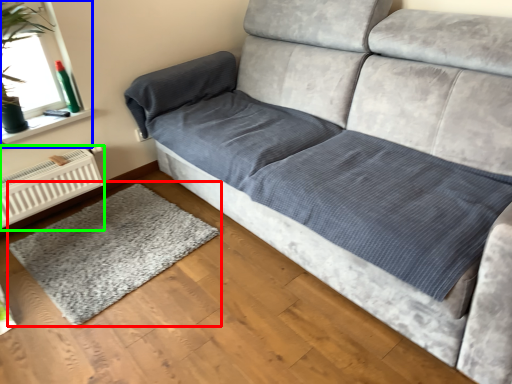
Question: Estimate the real-world distances between objects in this image. Which object is closer to mat (highlighted by a red box), window screen (highlighted by a blue box) or radiator (highlighted by a green box)?

Choices:
 (A) window screen
 (B) radiator

Answer: (B)